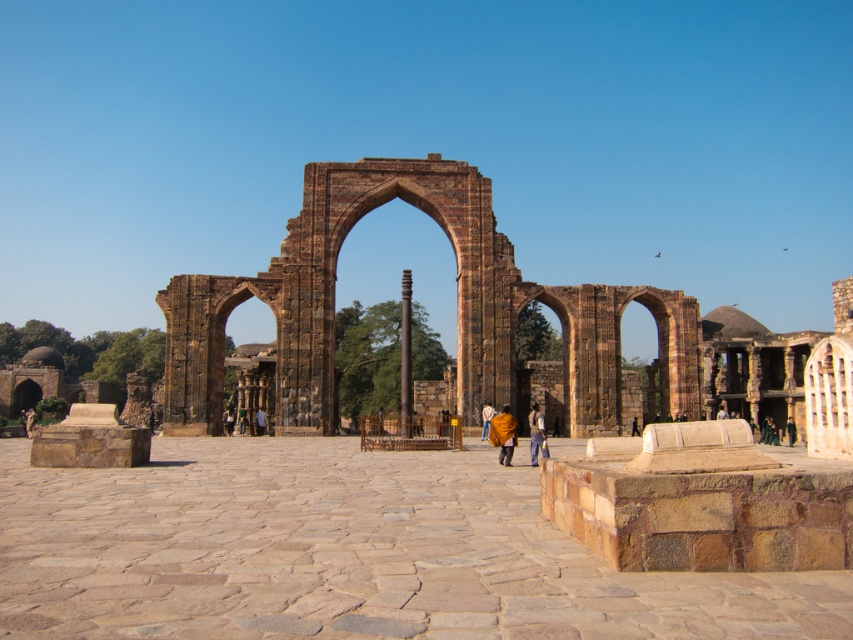
Consider the image. You are standing in front of the historical stone structure and see a point marked at coordinates (537, 433). According to the image, what object is this point located on?

The point at (537, 433) is located on the dark brown leather pants at center.

You are a tour guide standing at the base of the historical stone archway. You notice two items in the scene, the dark brown leather pants at center and the dark blue fabric at center. A visitor asks if they can walk directly between these two items without stepping on any of the surrounding stones. Given that the path between them is straight and unobstructed, how far apart are these two items?

The dark brown leather pants at center and the dark blue fabric at center are 15.21 meters apart from each other, so the visitor can walk directly between them as the distance is substantial and the path is straight and unobstructed.